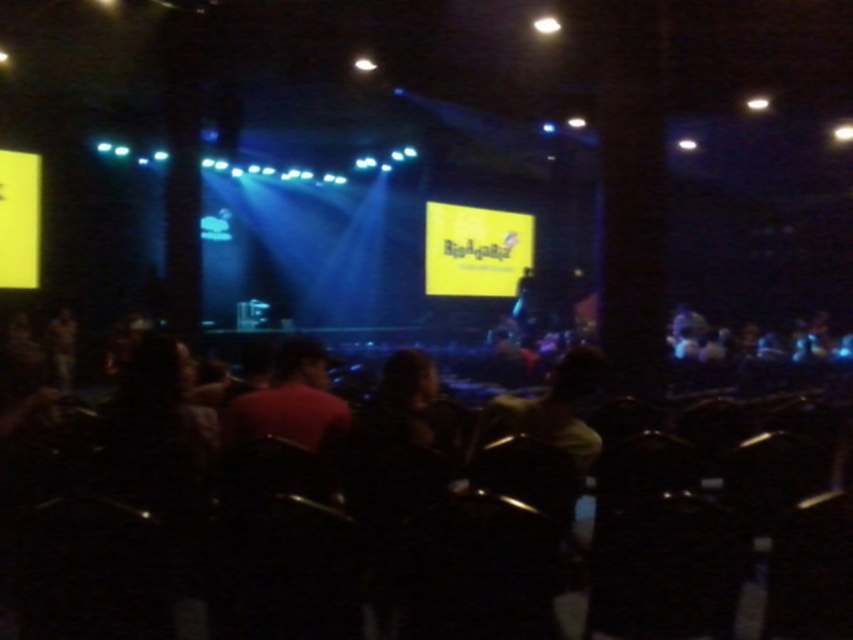
Question: Does black plastic chairs at lower center have a smaller size compared to yellow matte screen at center?

Choices:
 (A) yes
 (B) no

Answer: (B)

Question: Can you confirm if black plastic chairs at lower center is thinner than yellow matte screen at center?

Choices:
 (A) no
 (B) yes

Answer: (A)

Question: Which of the following is the farthest from the observer?

Choices:
 (A) yellow matte screen at center
 (B) black plastic chairs at lower center

Answer: (A)

Question: Which point appears closest to the camera in this image?

Choices:
 (A) (436, 205)
 (B) (491, 518)

Answer: (B)

Question: Observing the image, what is the correct spatial positioning of black plastic chairs at lower center in reference to yellow matte screen at center?

Choices:
 (A) below
 (B) above

Answer: (A)